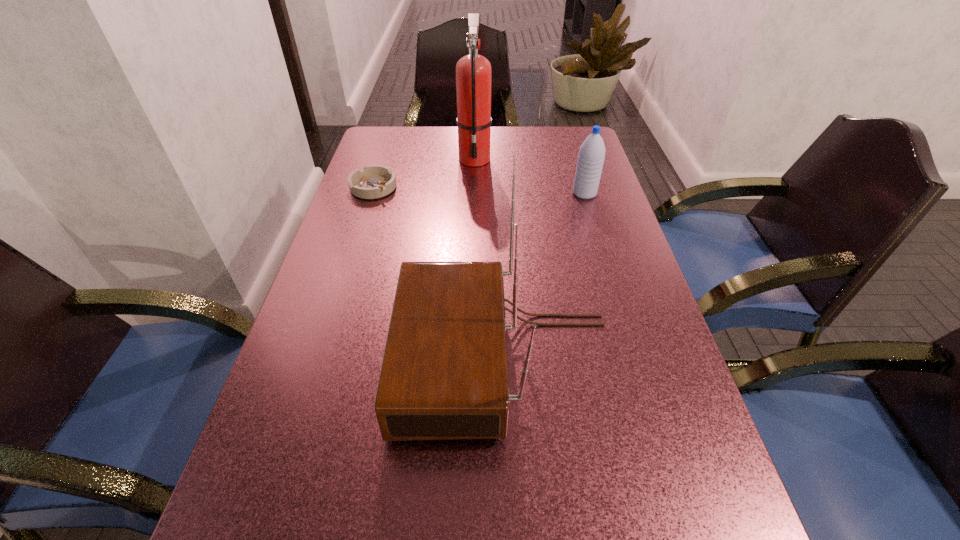
This screenshot has width=960, height=540. In order to click on vacant region at the far left corner of the desktop in this screenshot , I will do `click(401, 143)`.

At what (x,y) coordinates should I click in order to perform the action: click on vacant region at the far right corner of the desktop. Please return your answer as a coordinate pair (x, y). Image resolution: width=960 pixels, height=540 pixels. Looking at the image, I should click on (568, 143).

I want to click on empty location between the shortest object and the farthest object, so click(x=424, y=173).

The width and height of the screenshot is (960, 540). I want to click on free space between the ashtray and the water bottle, so click(x=479, y=191).

Find the location of a particular element. The image size is (960, 540). empty space between the ashtray and the third tallest object is located at coordinates (479, 191).

Where is `free space between the fire extinguisher and the shortest object`? This screenshot has height=540, width=960. free space between the fire extinguisher and the shortest object is located at coordinates pyautogui.click(x=424, y=173).

Locate an element on the screen. The width and height of the screenshot is (960, 540). free point between the rightmost object and the fire extinguisher is located at coordinates (530, 176).

This screenshot has height=540, width=960. Identify the location of empty space that is in between the rightmost object and the tallest object. (530, 176).

I want to click on free spot between the leftmost object and the tallest object, so click(424, 173).

Locate which object is the third closest to the ashtray. Please provide its 2D coordinates. Your answer should be formatted as a tuple, i.e. [(x, y)], where the tuple contains the x and y coordinates of a point satisfying the conditions above.

[(591, 156)]